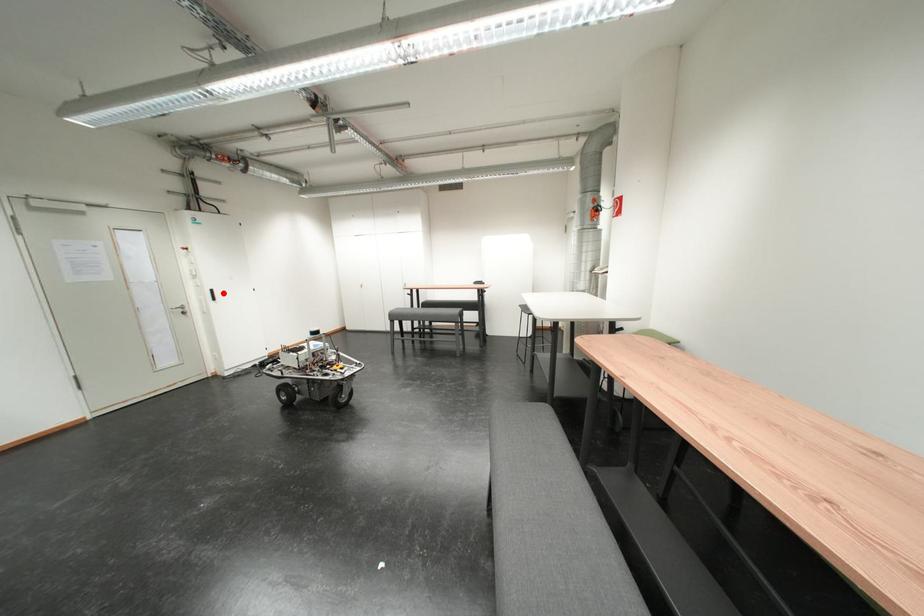
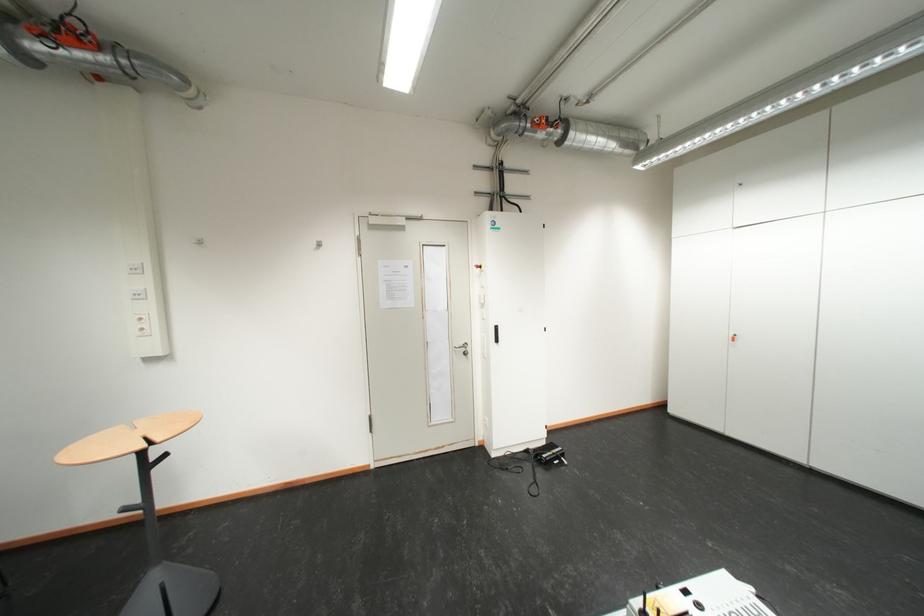
Question: I am providing you with two images of the same scene from different viewpoints. In image1, a red point is highlighted. Considering the same 3D point in image2, which of the following is correct?

Choices:
 (A) It is closer
 (B) It is farther

Answer: (B)